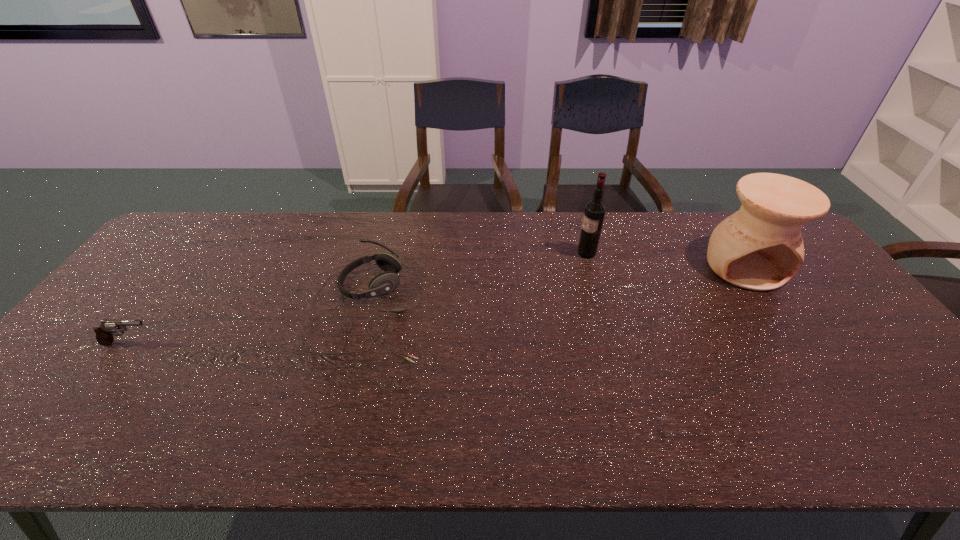
Find the location of a particular element. free spot between the rightmost object and the headset is located at coordinates (556, 286).

Image resolution: width=960 pixels, height=540 pixels. In order to click on unoccupied area between the second object from left to right and the third object from left to right in this screenshot , I will do `click(477, 280)`.

Locate an element on the screen. This screenshot has width=960, height=540. empty space that is in between the second object from left to right and the rightmost object is located at coordinates (556, 286).

I want to click on free space that is in between the headset and the pottery, so click(x=556, y=286).

The image size is (960, 540). Find the location of `free spot between the rightmost object and the second object from right to left`. free spot between the rightmost object and the second object from right to left is located at coordinates (665, 260).

You are a GUI agent. You are given a task and a screenshot of the screen. Output one action in this format:
    pyautogui.click(x=<x>, y=<y>)
    Task: Click on the free area in between the wine bottle and the pottery
    
    Given the screenshot: What is the action you would take?
    pyautogui.click(x=665, y=260)

Image resolution: width=960 pixels, height=540 pixels. In order to click on object that is the second nearest to the pottery in this screenshot , I will do `click(386, 282)`.

Choose which object is the nearest neighbor to the rightmost object. Please provide its 2D coordinates. Your answer should be formatted as a tuple, i.e. [(x, y)], where the tuple contains the x and y coordinates of a point satisfying the conditions above.

[(595, 210)]

Where is `free location that satisfies the following two spatial constraints: 1. at the open side of the pottery; 2. at the barrel of the pistol`? This screenshot has height=540, width=960. free location that satisfies the following two spatial constraints: 1. at the open side of the pottery; 2. at the barrel of the pistol is located at coordinates (797, 343).

Identify the location of free spot that satisfies the following two spatial constraints: 1. at the open side of the pottery; 2. at the barrel of the pistol. Image resolution: width=960 pixels, height=540 pixels. (797, 343).